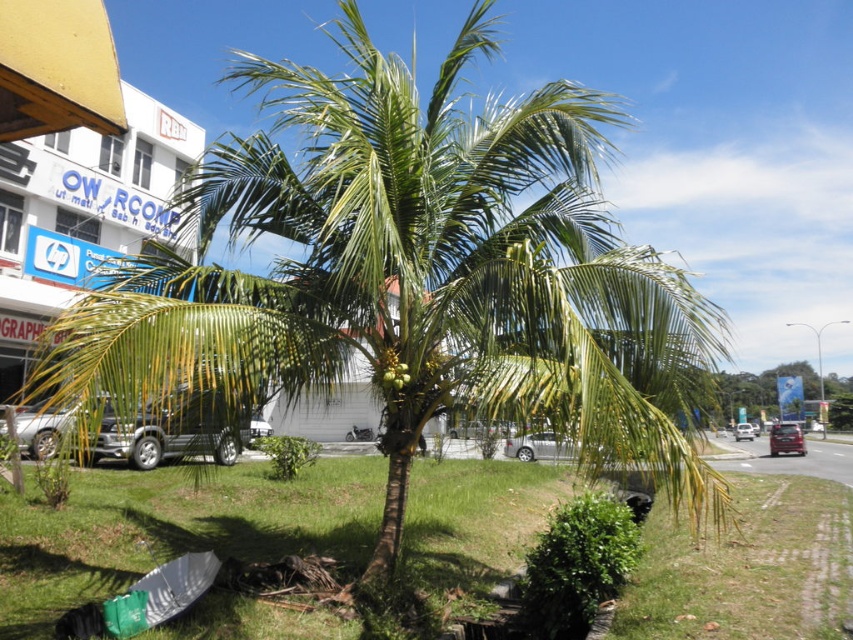
Between point (709, 600) and point (743, 429), which one is positioned behind?

Point (743, 429)

The image size is (853, 640). I want to click on green grass at center, so click(172, 529).

Can you confirm if green grass at center is taller than metallic silver car at center?

Yes.

From the picture: Does green grass at center come in front of metallic silver car at center?

Yes, green grass at center is closer to the viewer.

At what (x,y) coordinates should I click in order to perform the action: click on green grass at center. Please return your answer as a coordinate pair (x, y). This screenshot has width=853, height=640. Looking at the image, I should click on coord(172,529).

Is green leafy palm tree at center bigger than silver metallic car at center?

Yes.

How much distance is there between green leafy palm tree at center and silver metallic car at center?

53.90 meters

Where is `green leafy palm tree at center`? The image size is (853, 640). green leafy palm tree at center is located at coordinates (759, 388).